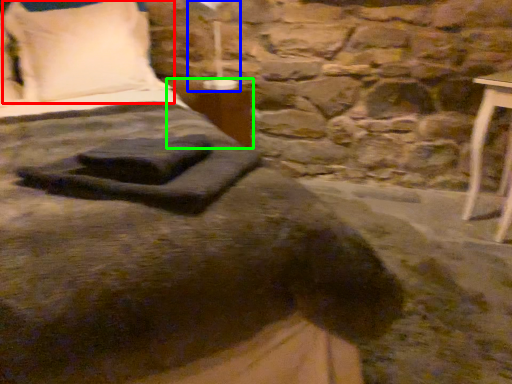
Question: Which object is positioned farthest from pillow (highlighted by a red box)? Select from bedside lamp (highlighted by a blue box) and table (highlighted by a green box).

Choices:
 (A) bedside lamp
 (B) table

Answer: (A)